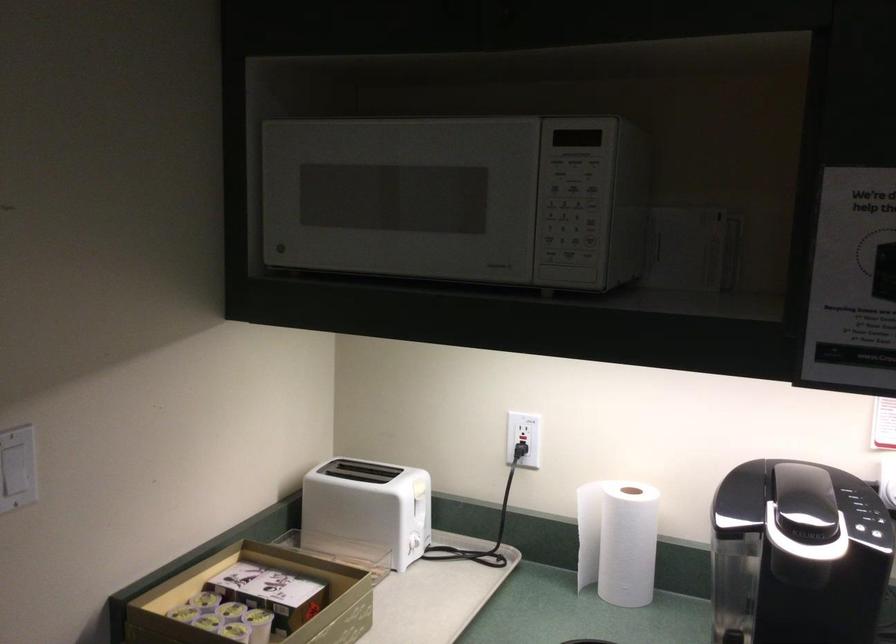
Where is `coffee machine handle`? coffee machine handle is located at coordinates 805,494.